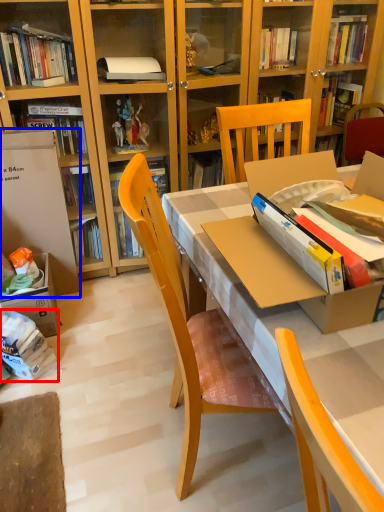
Question: Which of the following is the farthest to the observer, book (highlighted by a red box) or leftover (highlighted by a blue box)?

Choices:
 (A) book
 (B) leftover

Answer: (B)